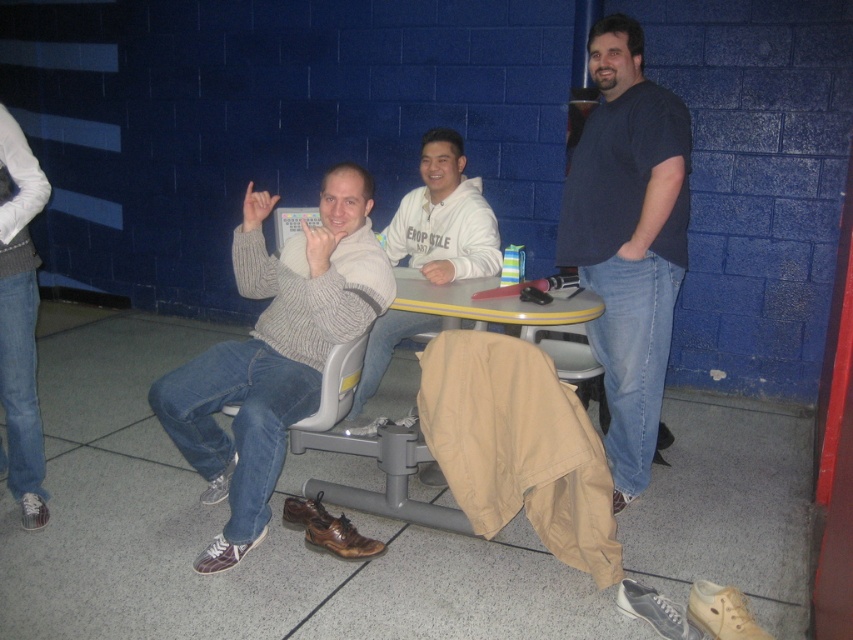
Is the position of dark blue t-shirt at right more distant than that of white knit sweater at center?

No, it is not.

This screenshot has height=640, width=853. What are the coordinates of `dark blue t-shirt at right` in the screenshot? It's located at (628, 237).

Image resolution: width=853 pixels, height=640 pixels. What are the coordinates of `dark blue t-shirt at right` in the screenshot? It's located at (628, 237).

Can you confirm if dark blue t-shirt at right is taller than yellow plastic table at center?

Indeed, dark blue t-shirt at right has a greater height compared to yellow plastic table at center.

Between point (579, 237) and point (592, 307), which one is positioned in front?

Point (592, 307) is more forward.

Between point (616, 202) and point (311, 448), which one is positioned in front?

Positioned in front is point (616, 202).

Where is `dark blue t-shirt at right`? This screenshot has height=640, width=853. dark blue t-shirt at right is located at coordinates (628, 237).

Who is positioned more to the left, white knit sweater at center or yellow plastic table at center?

white knit sweater at center is more to the left.

Identify the location of white knit sweater at center. Image resolution: width=853 pixels, height=640 pixels. (444, 216).

Does point (426, 138) come behind point (368, 337)?

That is True.

Locate an element on the screen. The height and width of the screenshot is (640, 853). white knit sweater at center is located at coordinates (444, 216).